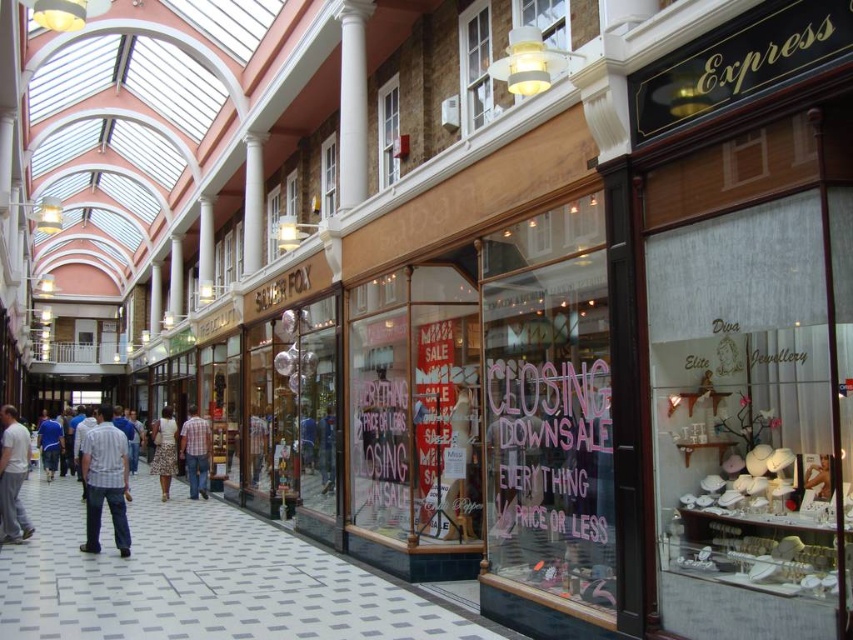
Who is more distant from viewer, (0, 502) or (44, 460)?

The point (44, 460) is more distant.

Does light gray cotton pants at center appear over blue shirt at center?

Yes, light gray cotton pants at center is above blue shirt at center.

The height and width of the screenshot is (640, 853). Find the location of `light gray cotton pants at center`. light gray cotton pants at center is located at coordinates (13, 476).

Find the location of a particular element. The width and height of the screenshot is (853, 640). light gray cotton pants at center is located at coordinates (13, 476).

This screenshot has width=853, height=640. What do you see at coordinates (105, 481) in the screenshot?
I see `light brown shirt at center` at bounding box center [105, 481].

The height and width of the screenshot is (640, 853). In order to click on light brown shirt at center in this screenshot , I will do `click(105, 481)`.

Between point (387, 321) and point (59, 440), which one is positioned behind?

Point (59, 440)

Is transparent glass window at center smaller than blue shirt at center?

Correct, transparent glass window at center occupies less space than blue shirt at center.

Where is `transparent glass window at center`? The height and width of the screenshot is (640, 853). transparent glass window at center is located at coordinates (491, 406).